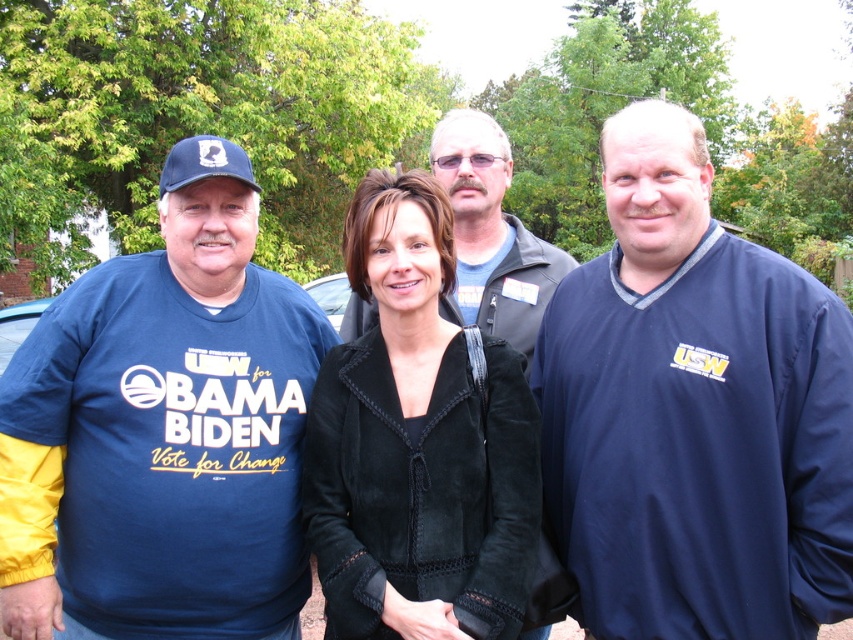
You are a photographer at this event and need to ensure both the velvet black jacket at center and the dark blue jacket at center are fully visible in your photo. Which jacket should you focus on to ensure the other doesn not block it?

The velvet black jacket at center is taller than the dark blue jacket at center, so focusing on the velvet black jacket at center will ensure it doesn not get blocked by the shorter dark blue jacket at center.